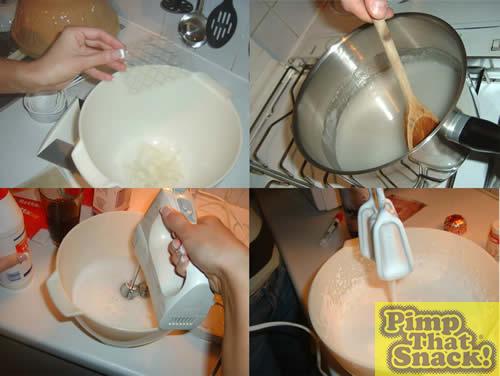
At what (x,y) coordinates should I click in order to perform the action: click on bowl. Please return your answer as a coordinate pair (x, y). This screenshot has width=500, height=376. Looking at the image, I should click on (61, 290).